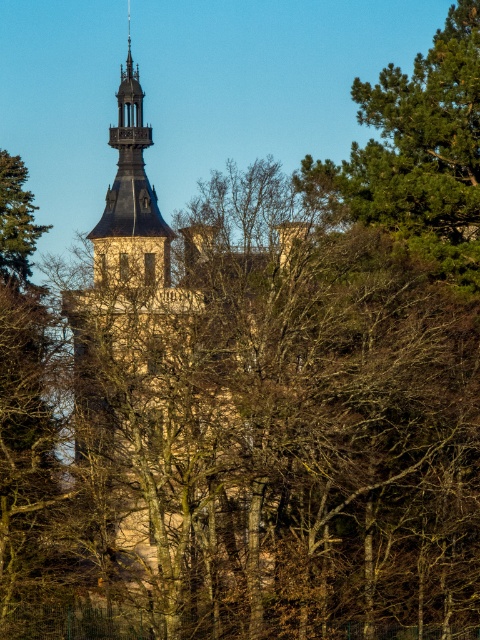
Question: Which of the following is the closest to the observer?

Choices:
 (A) (110, 253)
 (B) (1, 252)

Answer: (B)

Question: Does matte stone tower at upper center appear on the left side of green textured pine tree at left?

Choices:
 (A) no
 (B) yes

Answer: (A)

Question: Which object appears closest to the camera in this image?

Choices:
 (A) green needle-like foliage at upper right
 (B) green textured pine tree at left

Answer: (A)

Question: Which point appears closest to the camera in this image?

Choices:
 (A) (437, 221)
 (B) (124, 232)

Answer: (A)

Question: Is green needle-like foliage at upper right below green textured pine tree at left?

Choices:
 (A) yes
 (B) no

Answer: (B)

Question: Is green needle-like foliage at upper right positioned at the back of matte stone tower at upper center?

Choices:
 (A) yes
 (B) no

Answer: (B)